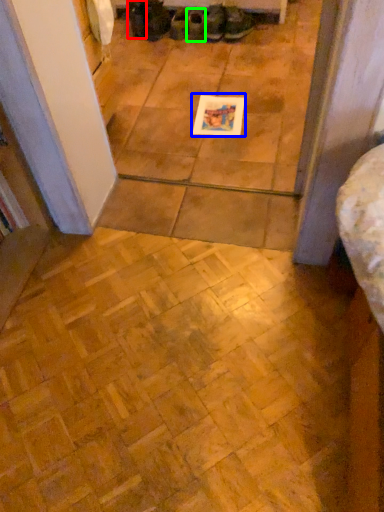
Question: Which object is the farthest from footwear (highlighted by a red box)? Choose among these: postcard (highlighted by a blue box) or footwear (highlighted by a green box).

Choices:
 (A) postcard
 (B) footwear

Answer: (A)